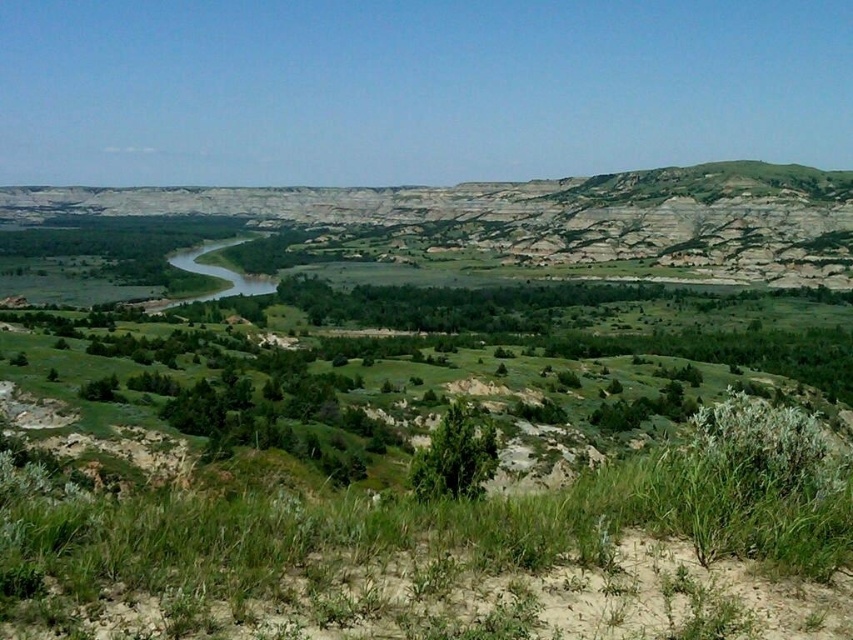
Is rugged stone mountain at center smaller than green leafy bush at center?

Incorrect, rugged stone mountain at center is not smaller in size than green leafy bush at center.

Can you confirm if rugged stone mountain at center is shorter than green leafy bush at center?

No.

Is point (358, 250) farther from viewer compared to point (495, 456)?

Yes, it is.

Image resolution: width=853 pixels, height=640 pixels. I want to click on rugged stone mountain at center, so click(543, 218).